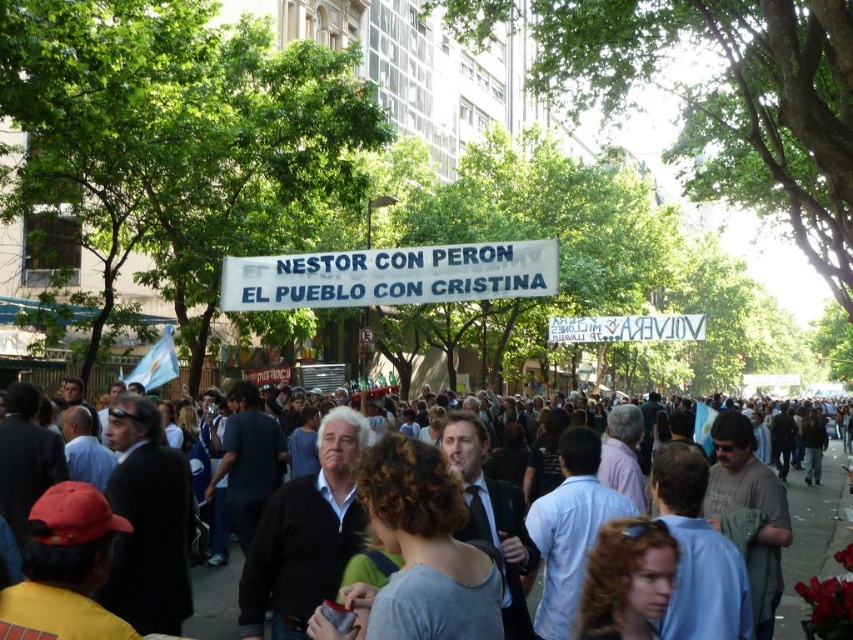
Question: Does white paper banner at center have a greater width compared to gray cotton shirt at center?

Choices:
 (A) no
 (B) yes

Answer: (A)

Question: Which point is closer to the camera?

Choices:
 (A) white paper banner at center
 (B) gray cotton shirt at center

Answer: (B)

Question: Is white paper banner at center smaller than gray cotton shirt at center?

Choices:
 (A) yes
 (B) no

Answer: (A)

Question: Is white paper banner at center positioned in front of gray cotton shirt at center?

Choices:
 (A) no
 (B) yes

Answer: (A)